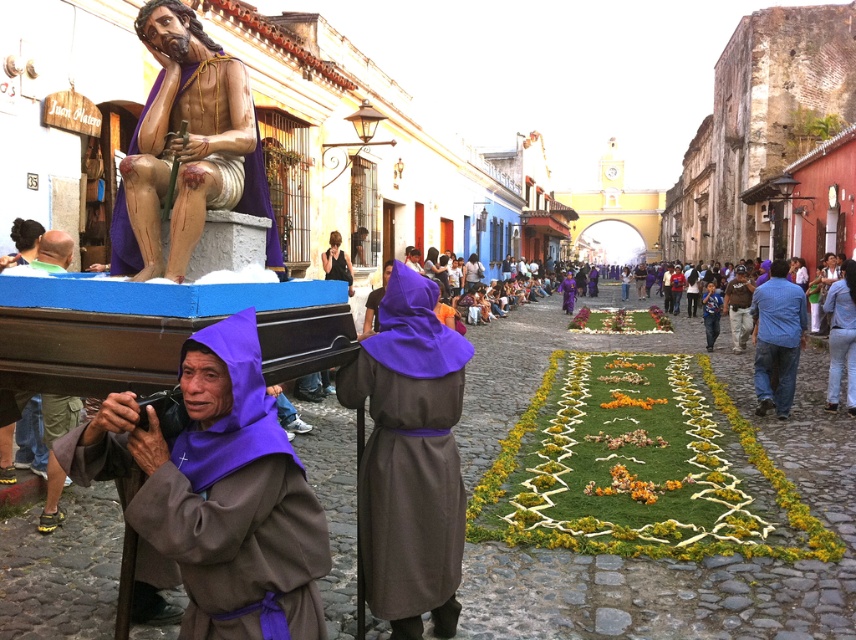
You are standing on the cobblestone street and see both the brown leather jacket at center and the blue cotton shirt at center. Which one is nearer to you?

The brown leather jacket at center is closer to the viewer than the blue cotton shirt at center.

You are a photographer standing in the middle of the street. You see a brown leather jacket at center and a blue cotton shirt at center. Can you fit both subjects into your camera frame if your camera has a maximum width of 6 feet?

The brown leather jacket at center and blue cotton shirt at center are 7.11 feet apart from each other. Since the distance between them exceeds the camera frame width of 6 feet, you cannot fit both subjects into the frame.